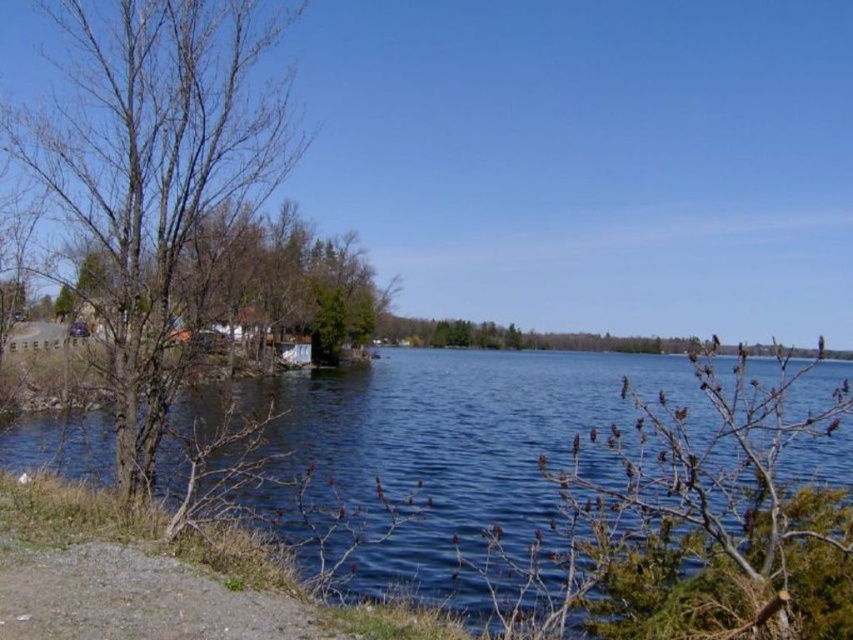
Question: Is blue water at center bigger than bare wood tree at left?

Choices:
 (A) yes
 (B) no

Answer: (A)

Question: Which object appears closest to the camera in this image?

Choices:
 (A) blue water at center
 (B) bare wood tree at left

Answer: (A)

Question: Does blue water at center have a larger size compared to bare wood tree at left?

Choices:
 (A) no
 (B) yes

Answer: (B)

Question: Which point is farther to the camera?

Choices:
 (A) (16, 125)
 (B) (172, 467)

Answer: (A)

Question: Is blue water at center thinner than bare wood tree at left?

Choices:
 (A) no
 (B) yes

Answer: (A)

Question: Which object is closer to the camera taking this photo?

Choices:
 (A) blue water at center
 (B) bare wood tree at left

Answer: (A)